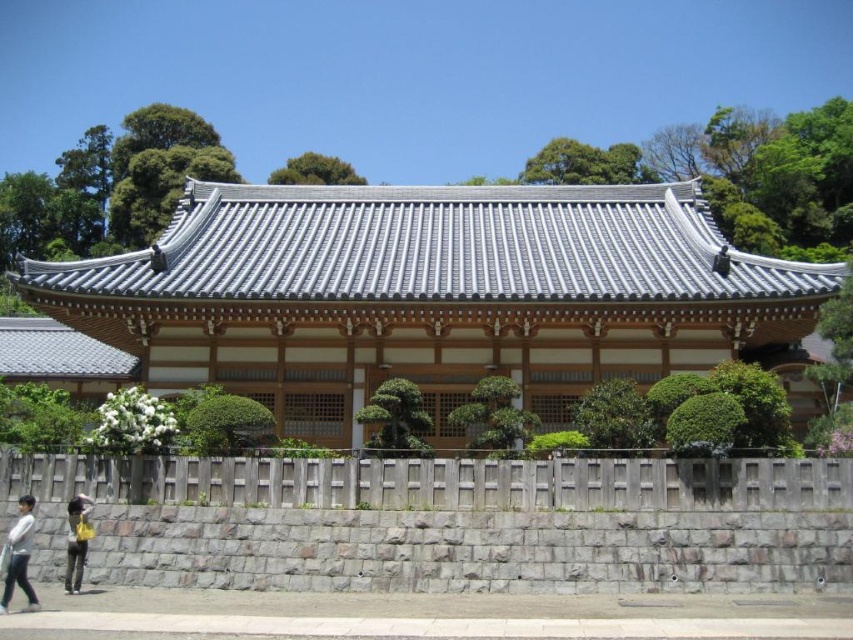
You are standing in front of a traditional Japanese temple with a steep roof and wooden framework. You notice a white cotton shirt at lower left and a yellow fabric bag at lower left. Which item is located to the left of the other?

The white cotton shirt at lower left is positioned on the left side of the yellow fabric bag at lower left.

You are standing in front of a traditional Japanese temple. You see the gray tile roof at center and the yellow fabric bag at lower left. Which object is higher in position?

The gray tile roof at center is taller than the yellow fabric bag at lower left.

You are standing in front of a traditional Japanese temple with two points marked on its roof. The first point is at coordinate point (x=718, y=252) and the second is at point (x=82, y=493). Which point is closer to you?

Point (x=718, y=252) is further to the viewer than point (x=82, y=493), so the second point is closer to you.